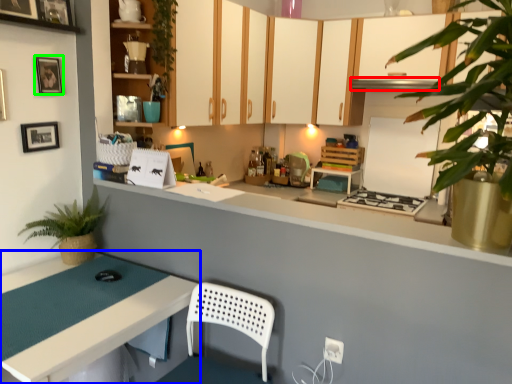
Question: Estimate the real-world distances between objects in this image. Which object is closer to exhaust hood (highlighted by a red box), table (highlighted by a blue box) or picture frame (highlighted by a green box)?

Choices:
 (A) table
 (B) picture frame

Answer: (B)